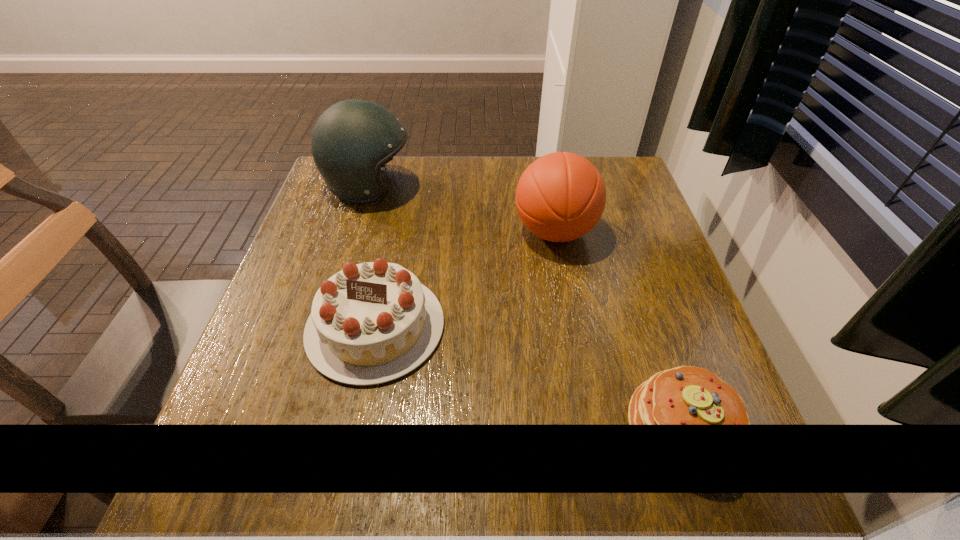
This screenshot has height=540, width=960. Identify the location of blank space at the right edge of the desktop. (618, 291).

At what (x,y) coordinates should I click in order to perform the action: click on vacant space at the near left corner. Please return your answer as a coordinate pair (x, y). Looking at the image, I should click on (257, 461).

Where is `free space at the far right corner of the desktop`? free space at the far right corner of the desktop is located at coordinates (620, 185).

In the image, there is a desktop. Find the location of `blank space at the near right corner`. blank space at the near right corner is located at coordinates (765, 478).

In order to click on vacant area between the pancake and the birthday cake in this screenshot , I will do `click(530, 377)`.

Where is `empty location between the shortest object and the birthday cake`? This screenshot has width=960, height=540. empty location between the shortest object and the birthday cake is located at coordinates (530, 377).

Locate an element on the screen. free spot between the second shortest object and the shortest object is located at coordinates (530, 377).

Find the location of a particular element. vacant space that's between the pancake and the third tallest object is located at coordinates (530, 377).

You are a GUI agent. You are given a task and a screenshot of the screen. Output one action in this format:
    pyautogui.click(x=<x>, y=<y>)
    Task: Click on the free space between the second tallest object and the football helmet
    The width and height of the screenshot is (960, 540).
    Given the screenshot: What is the action you would take?
    pyautogui.click(x=462, y=210)

The height and width of the screenshot is (540, 960). In order to click on free spot between the third shortest object and the football helmet in this screenshot , I will do `click(462, 210)`.